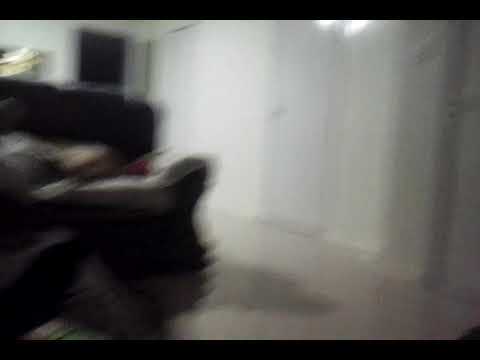
Locate an element on the screen. area room light reflection is located at coordinates (352, 29).